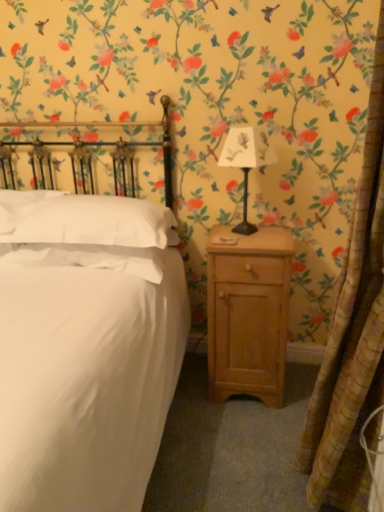
What is the approximate height of light wood nightstand at right?

31.58 inches.

I want to click on white soft pillow at upper left, marked as the 1th pillow in a left-to-right arrangement, so click(x=22, y=206).

What are the coordinates of `textured beige curtain at right` in the screenshot? It's located at (352, 336).

From a real-world perspective, does white soft pillow at left, which is the first pillow from right to left, stand above white matte bed at center?

Yes, from a real-world perspective, white soft pillow at left, which is the first pillow from right to left, is above white matte bed at center.

From their relative heights in the image, would you say white soft pillow at left, which is the first pillow from right to left, is taller or shorter than white matte bed at center?

Considering their sizes, white soft pillow at left, which is the first pillow from right to left, has less height than white matte bed at center.

Is white soft pillow at left, which is the first pillow from right to left, positioned far away from white matte bed at center?

No, white soft pillow at left, which is the first pillow from right to left, is not far away from white matte bed at center.

How many degrees apart are the facing directions of white soft pillow at left, the 2th pillow when ordered from left to right, and white matte bed at center?

The angle between the facing direction of white soft pillow at left, the 2th pillow when ordered from left to right, and the facing direction of white matte bed at center is 0.000489 degrees.

Who is bigger, white soft pillow at left, which is the first pillow from right to left, or white soft pillow at upper left, marked as the 1th pillow in a left-to-right arrangement?

white soft pillow at left, which is the first pillow from right to left.

Which is closer to the camera, (126, 237) or (6, 196)?

Point (126, 237) appears to be closer to the viewer than point (6, 196).

From a real-world perspective, does white soft pillow at left, the 2th pillow when ordered from left to right, stand above white soft pillow at upper left, the second pillow from the right?

Yes, from a real-world perspective, white soft pillow at left, the 2th pillow when ordered from left to right, is on top of white soft pillow at upper left, the second pillow from the right.

Does textured beige curtain at right lie in front of white soft pillow at upper left, marked as the 1th pillow in a left-to-right arrangement?

Yes, textured beige curtain at right is closer to the camera.

How different are the orientations of textured beige curtain at right and white soft pillow at upper left, the second pillow from the right, in degrees?

textured beige curtain at right and white soft pillow at upper left, the second pillow from the right, are facing 87.7 degrees away from each other.

From a real-world perspective, does textured beige curtain at right sit lower than white soft pillow at upper left, marked as the 1th pillow in a left-to-right arrangement?

Yes.

Is textured beige curtain at right spatially inside white soft pillow at upper left, marked as the 1th pillow in a left-to-right arrangement, or outside of it?

The correct answer is: outside.

Which object is further away from the camera, light wood nightstand at right or white soft pillow at left, the 2th pillow when ordered from left to right?

light wood nightstand at right is behind.

Based on the photo, considering the positions of objects light wood nightstand at right and white soft pillow at left, the 2th pillow when ordered from left to right, in the image provided, who is more to the left, light wood nightstand at right or white soft pillow at left, the 2th pillow when ordered from left to right,?

white soft pillow at left, the 2th pillow when ordered from left to right.

Considering the positions of point (252, 257) and point (8, 206), is point (252, 257) closer or farther from the camera than point (8, 206)?

Point (252, 257) is closer to the camera than point (8, 206).

Which is closer, (84, 475) or (252, 159)?

The point (84, 475) is more forward.

From a real-world perspective, who is located higher, white matte bed at center or metallic black lamp at center-right?

In real-world perspective, metallic black lamp at center-right is above.

Between white matte bed at center and metallic black lamp at center-right, which one appears on the left side from the viewer's perspective?

Positioned to the left is white matte bed at center.

In terms of size, does light wood nightstand at right appear bigger or smaller than white matte bed at center?

Clearly, light wood nightstand at right is smaller in size than white matte bed at center.

From the picture: Is light wood nightstand at right touching white matte bed at center?

No, light wood nightstand at right is not touching white matte bed at center.

What are the coordinates of `bed above the light wood nightstand at right (from a real-world perspective)` in the screenshot? It's located at (88, 349).

How much distance is there between light wood nightstand at right and white matte bed at center?

light wood nightstand at right and white matte bed at center are 19.62 inches apart.

Which pillow is the 2nd one when counting from the left side of the light wood nightstand at right? Please provide its 2D coordinates.

[(22, 206)]

Measure the distance from white soft pillow at upper left, marked as the 1th pillow in a left-to-right arrangement, to light wood nightstand at right.

The distance of white soft pillow at upper left, marked as the 1th pillow in a left-to-right arrangement, from light wood nightstand at right is 3.33 feet.

Is the position of white soft pillow at upper left, marked as the 1th pillow in a left-to-right arrangement, more distant than that of light wood nightstand at right?

Yes, white soft pillow at upper left, marked as the 1th pillow in a left-to-right arrangement, is further from the camera.

Is white soft pillow at upper left, marked as the 1th pillow in a left-to-right arrangement, looking in the opposite direction of light wood nightstand at right?

No, white soft pillow at upper left, marked as the 1th pillow in a left-to-right arrangement,'s orientation is not away from light wood nightstand at right.

Starting from the white matte bed at center, which pillow is the 1st one behind? Please provide its 2D coordinates.

[(83, 220)]

Identify the location of pillow that is above the white soft pillow at left, the 2th pillow when ordered from left to right (from the image's perspective). (22, 206).

Based on their spatial positions, is white soft pillow at left, which is the first pillow from right to left, or white soft pillow at upper left, the second pillow from the right, further from white matte bed at center?

white soft pillow at upper left, the second pillow from the right, is positioned further to the anchor white matte bed at center.

Looking at the image, which one is located closer to metallic black lamp at center-right, white soft pillow at upper left, marked as the 1th pillow in a left-to-right arrangement, or white soft pillow at left, which is the first pillow from right to left?

The object closer to metallic black lamp at center-right is white soft pillow at left, which is the first pillow from right to left.

From the image, which object appears to be farther from textured beige curtain at right, white soft pillow at upper left, the second pillow from the right, or light wood nightstand at right?

white soft pillow at upper left, the second pillow from the right, is positioned further to the anchor textured beige curtain at right.

From the picture: Looking at the image, which one is located closer to light wood nightstand at right, textured beige curtain at right or white matte bed at center?

textured beige curtain at right is closer to light wood nightstand at right.

Considering their positions, is metallic black lamp at center-right positioned closer to light wood nightstand at right than white soft pillow at upper left, the second pillow from the right?

Based on the image, metallic black lamp at center-right appears to be nearer to light wood nightstand at right.

Based on the photo, when comparing their distances from metallic black lamp at center-right, does textured beige curtain at right or white matte bed at center seem further?

textured beige curtain at right lies further to metallic black lamp at center-right than the other object.

Which object lies nearer to the anchor point light wood nightstand at right, white soft pillow at left, which is the first pillow from right to left, or textured beige curtain at right?

textured beige curtain at right.

When comparing their distances from light wood nightstand at right, does textured beige curtain at right or white soft pillow at left, the 2th pillow when ordered from left to right, seem further?

white soft pillow at left, the 2th pillow when ordered from left to right.

Locate an element on the screen. bedside lamp between textured beige curtain at right and light wood nightstand at right along the z-axis is located at coordinates (246, 161).

Locate an element on the screen. pillow situated between white soft pillow at upper left, marked as the 1th pillow in a left-to-right arrangement, and metallic black lamp at center-right from left to right is located at coordinates (83, 220).

This screenshot has width=384, height=512. Identify the location of bedside lamp situated between white soft pillow at left, which is the first pillow from right to left, and light wood nightstand at right from left to right. pyautogui.click(x=246, y=161).

What are the coordinates of `curtain between white matte bed at center and metallic black lamp at center-right along the z-axis` in the screenshot? It's located at (352, 336).